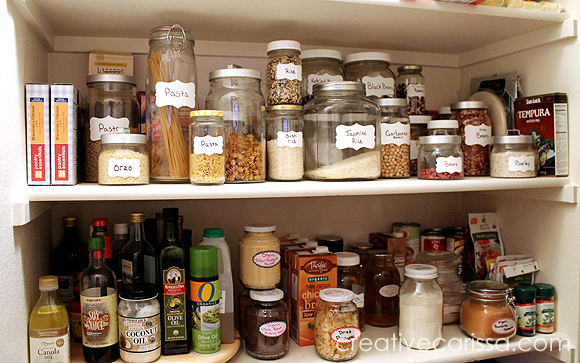
Where is `boxed foods`? This screenshot has width=580, height=363. boxed foods is located at coordinates (x=38, y=118), (x=61, y=123), (x=107, y=63), (x=553, y=119), (x=314, y=258), (x=290, y=244), (x=284, y=238), (x=391, y=249).